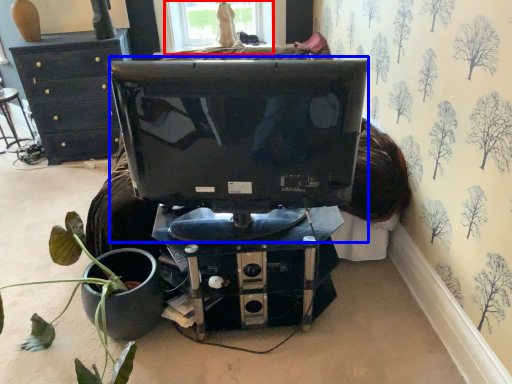
Question: Which of the following is the closest to the observer, window (highlighted by a red box) or computer monitor (highlighted by a blue box)?

Choices:
 (A) window
 (B) computer monitor

Answer: (B)